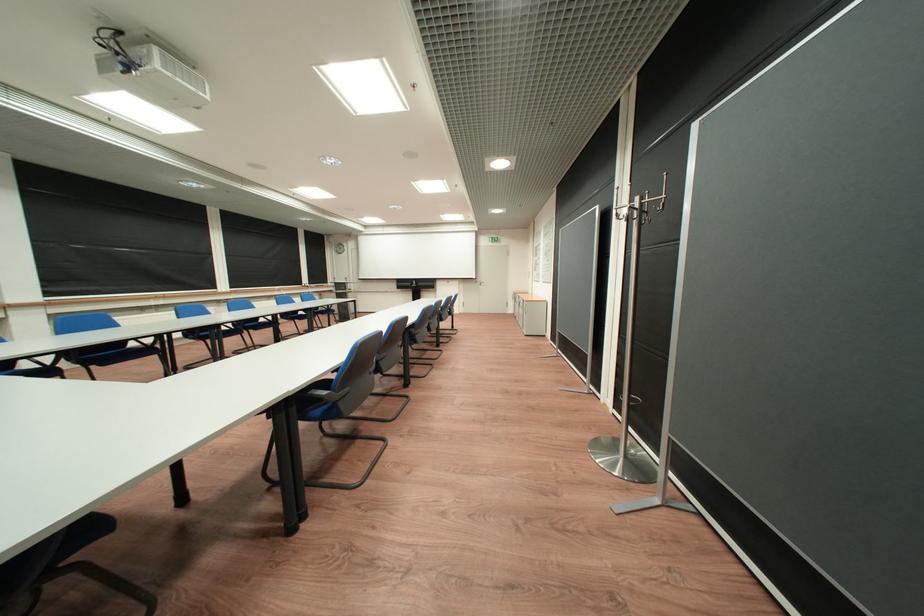
This screenshot has width=924, height=616. I want to click on cabinet handle, so click(x=538, y=306).